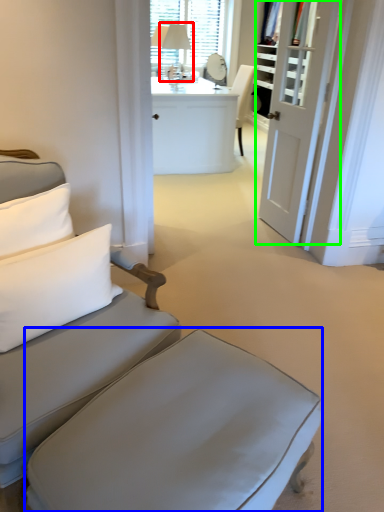
Question: Estimate the real-world distances between objects in this image. Which object is closer to table lamp (highlighted by a red box), table (highlighted by a blue box) or door (highlighted by a green box)?

Choices:
 (A) table
 (B) door

Answer: (B)